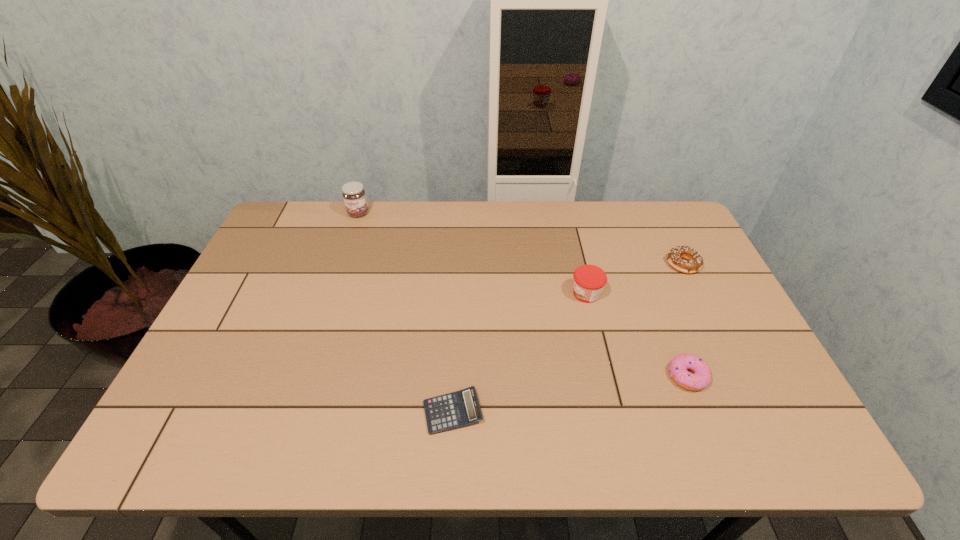
I want to click on blank region between the fourth object from left to right and the calculator, so click(x=570, y=394).

Identify the location of free space between the nearer doughnut and the third object from right to left. This screenshot has height=540, width=960. (637, 335).

The height and width of the screenshot is (540, 960). In order to click on empty space that is in between the second object from left to right and the right doughnut in this screenshot , I will do `click(567, 338)`.

At what (x,y) coordinates should I click in order to perform the action: click on free spot between the second object from right to left and the taller jam. Please return your answer as a coordinate pair (x, y). The height and width of the screenshot is (540, 960). Looking at the image, I should click on (523, 295).

What are the coordinates of `free space between the shortest object and the nearer doughnut` in the screenshot? It's located at (570, 394).

Locate which object is the third closest to the fourth object from right to left. Please provide its 2D coordinates. Your answer should be formatted as a tuple, i.e. [(x, y)], where the tuple contains the x and y coordinates of a point satisfying the conditions above.

[(695, 261)]

Where is `object that is the fourth closest to the shortest object`? object that is the fourth closest to the shortest object is located at coordinates (353, 193).

Identify the location of free region that satisfies the following two spatial constraints: 1. on the front label of the calculator; 2. on the right side of the tallest object. (292, 412).

Locate an element on the screen. vacant space that satisfies the following two spatial constraints: 1. on the front label of the second object from left to right; 2. on the left side of the farther jam is located at coordinates (292, 412).

Locate an element on the screen. free space that satisfies the following two spatial constraints: 1. on the label side of the third object from left to right; 2. on the back side of the nearer doughnut is located at coordinates (606, 376).